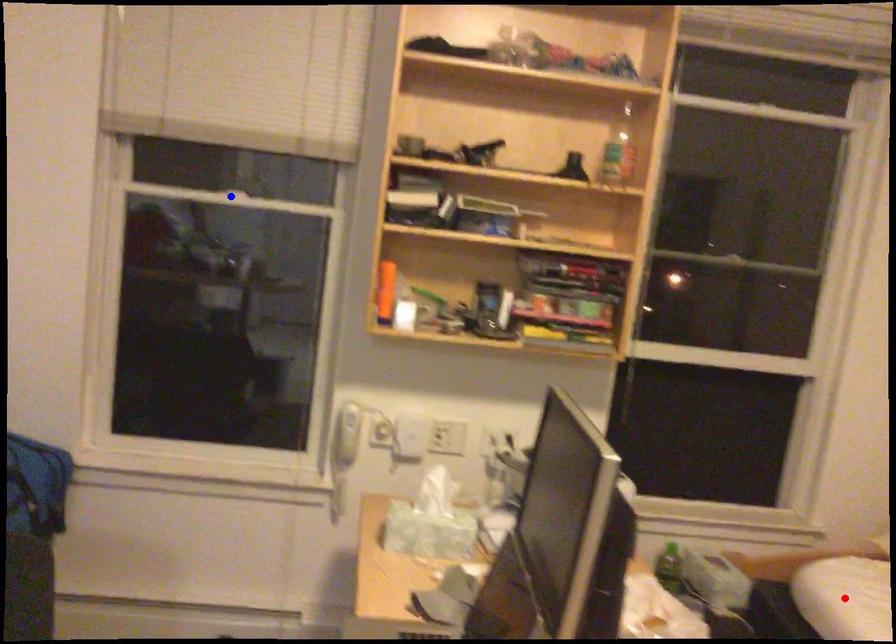
Question: In the image, two points are highlighted. Which point is nearer to the camera? Reply with the corresponding letter.

Choices:
 (A) blue point
 (B) red point

Answer: (B)